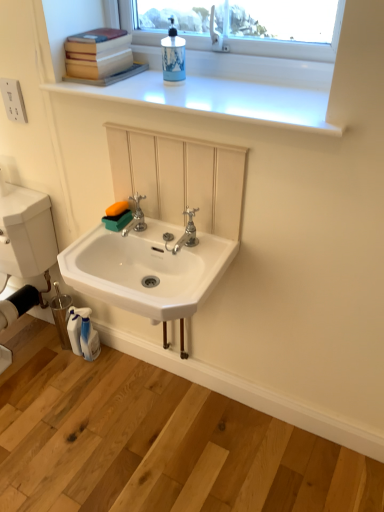
The height and width of the screenshot is (512, 384). What are the coordinates of `blank space above hardcover books at upper left (from a real-world perspective)` in the screenshot? It's located at (100, 31).